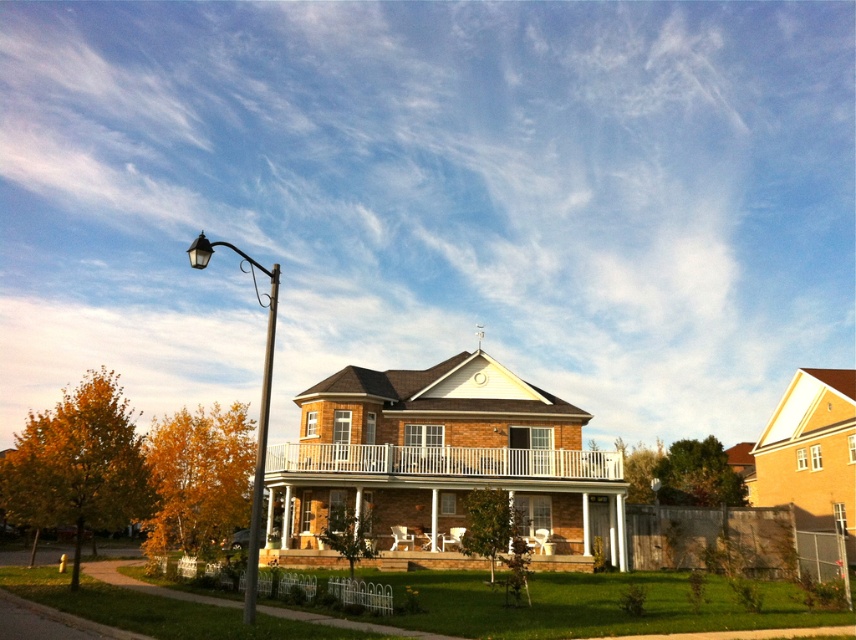
Who is more distant from viewer, (260, 408) or (271, 291)?

Point (260, 408)

Which is in front, point (263, 378) or point (262, 465)?

Positioned in front is point (262, 465).

Measure the distance between polished metal street light at left and camera.

The distance of polished metal street light at left from camera is 12.08 meters.

Find the location of `polished metal street light at left`. polished metal street light at left is located at coordinates (259, 410).

Is white painted wood balcony at center above polished metal street light at left?

No.

Who is positioned more to the right, white painted wood balcony at center or polished metal street light at left?

white painted wood balcony at center

Between point (485, 467) and point (201, 262), which one is positioned in front?

Point (201, 262)

The height and width of the screenshot is (640, 856). What are the coordinates of `white painted wood balcony at center` in the screenshot? It's located at (443, 460).

Does white painted wood balcony at center appear on the left side of metallic pole at left?

Incorrect, white painted wood balcony at center is not on the left side of metallic pole at left.

Who is more forward, (x=515, y=460) or (x=278, y=276)?

Point (x=278, y=276) is in front.

Is point (519, 464) farther from viewer compared to point (251, 611)?

Yes, it is behind point (251, 611).

I want to click on white painted wood balcony at center, so click(443, 460).